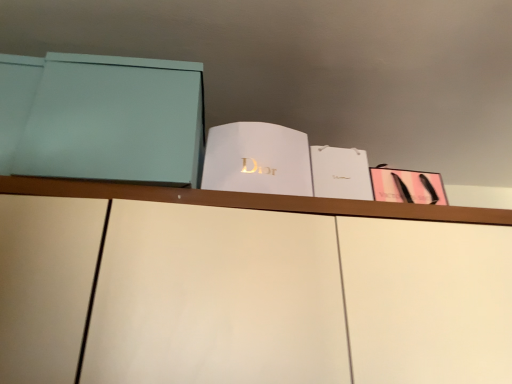
Question: Would you say white paper at center, acting as the second paperback book starting from the left, is part of white paper at center, arranged as the 3th paperback book when viewed from the left,'s contents?

Choices:
 (A) yes
 (B) no

Answer: (B)

Question: Is white paper at center, arranged as the 3th paperback book when viewed from the left, next to white paper at center, acting as the second paperback book starting from the left?

Choices:
 (A) yes
 (B) no

Answer: (B)

Question: Does white paper at center, arranged as the 3th paperback book when viewed from the left, come in front of white paper at center, marked as the 3th paperback book in a right-to-left arrangement?

Choices:
 (A) no
 (B) yes

Answer: (A)

Question: Does white paper at center, which appears as the second paperback book when viewed from the right, turn towards white paper at center, acting as the second paperback book starting from the left?

Choices:
 (A) yes
 (B) no

Answer: (B)

Question: Can you confirm if white paper at center, which appears as the second paperback book when viewed from the right, is wider than white paper at center, acting as the second paperback book starting from the left?

Choices:
 (A) no
 (B) yes

Answer: (A)

Question: Looking at the image, does pink matte paper at upper right, positioned as the 1th paperback book in right-to-left order, seem bigger or smaller compared to white paper at center, marked as the 3th paperback book in a right-to-left arrangement?

Choices:
 (A) small
 (B) big

Answer: (A)

Question: In terms of width, does pink matte paper at upper right, positioned as the 1th paperback book in right-to-left order, look wider or thinner when compared to white paper at center, acting as the second paperback book starting from the left?

Choices:
 (A) wide
 (B) thin

Answer: (B)

Question: Does point tap(439, 200) appear closer or farther from the camera than point tap(216, 148)?

Choices:
 (A) closer
 (B) farther

Answer: (B)

Question: From a real-world perspective, is pink matte paper at upper right, positioned as the 1th paperback book in right-to-left order, positioned above or below white paper at center, acting as the second paperback book starting from the left?

Choices:
 (A) above
 (B) below

Answer: (B)

Question: Considering the positions of matte teal box at left, marked as the first paperback book in a left-to-right arrangement, and white paper at center, which appears as the second paperback book when viewed from the right, in the image, is matte teal box at left, marked as the first paperback book in a left-to-right arrangement, wider or thinner than white paper at center, which appears as the second paperback book when viewed from the right,?

Choices:
 (A) wide
 (B) thin

Answer: (A)

Question: From the image's perspective, is matte teal box at left, marked as the first paperback book in a left-to-right arrangement, located above or below white paper at center, arranged as the 3th paperback book when viewed from the left?

Choices:
 (A) below
 (B) above

Answer: (B)

Question: In the image, is matte teal box at left, marked as the first paperback book in a left-to-right arrangement, on the left side or the right side of white paper at center, arranged as the 3th paperback book when viewed from the left?

Choices:
 (A) left
 (B) right

Answer: (A)

Question: Does point (114, 94) appear closer or farther from the camera than point (343, 182)?

Choices:
 (A) farther
 (B) closer

Answer: (B)

Question: From the image's perspective, relative to pink matte paper at upper right, which is counted as the fourth paperback book, starting from the left, is matte teal box at left, which is the 4th paperback book in right-to-left order, above or below?

Choices:
 (A) below
 (B) above

Answer: (B)

Question: Is matte teal box at left, marked as the first paperback book in a left-to-right arrangement, taller or shorter than pink matte paper at upper right, which is counted as the fourth paperback book, starting from the left?

Choices:
 (A) short
 (B) tall

Answer: (B)